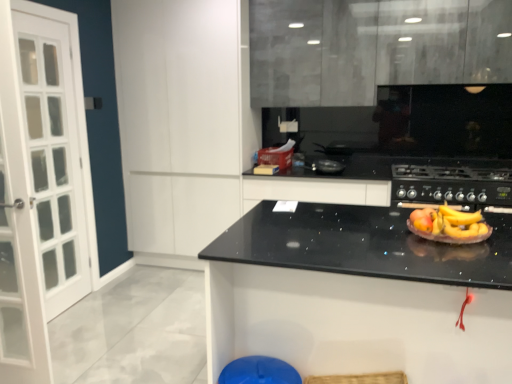
Question: Considering their positions, is black matte gas stove at center located in front of or behind matte black paper plate at center?

Choices:
 (A) front
 (B) behind

Answer: (B)

Question: Which is correct: black matte gas stove at center is inside matte black paper plate at center, or outside of it?

Choices:
 (A) outside
 (B) inside

Answer: (A)

Question: Which object is the farthest from the matte gray cabinets at upper center, which appears as the 1th cabinetry when viewed from the right?

Choices:
 (A) black matte gas stove at center
 (B) matte black paper plate at center
 (C) white matte cabinet at upper left, which is counted as the second cabinetry, starting from the right
 (D) black granite countertop at center
 (E) blue plastic bar stool at lower center

Answer: (E)

Question: Which of these objects is positioned closest to the black matte gas stove at center?

Choices:
 (A) matte black paper plate at center
 (B) matte gray cabinets at upper center, the second cabinetry from the left
 (C) blue plastic bar stool at lower center
 (D) black granite countertop at center
 (E) white matte cabinet at upper left, which is the first cabinetry in left-to-right order

Answer: (B)